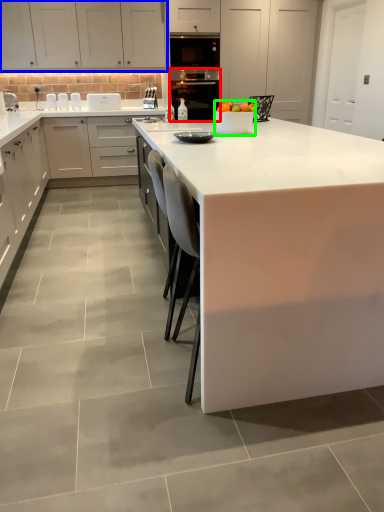
Question: Which is farther away from home appliance (highlighted by a red box)? cabinetry (highlighted by a blue box) or appliance (highlighted by a green box)?

Choices:
 (A) cabinetry
 (B) appliance

Answer: (B)